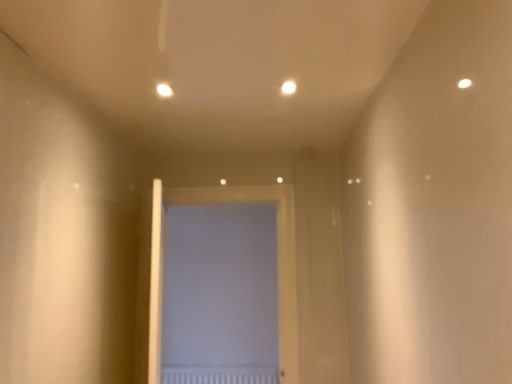
Question: Does white matte door at center turn towards white textured radiator at center?

Choices:
 (A) yes
 (B) no

Answer: (B)

Question: From a real-world perspective, is white matte door at center below white textured radiator at center?

Choices:
 (A) no
 (B) yes

Answer: (A)

Question: Would you say white matte door at center contains white textured radiator at center?

Choices:
 (A) yes
 (B) no

Answer: (B)

Question: Is white matte door at center turned away from white textured radiator at center?

Choices:
 (A) no
 (B) yes

Answer: (B)

Question: Is white matte door at center next to white textured radiator at center?

Choices:
 (A) yes
 (B) no

Answer: (B)

Question: Is matte white light at upper center, the second light viewed from the right, to the left or to the right of white matte door at center in the image?

Choices:
 (A) right
 (B) left

Answer: (B)

Question: Based on their sizes in the image, would you say matte white light at upper center, the second light viewed from the right, is bigger or smaller than white matte door at center?

Choices:
 (A) big
 (B) small

Answer: (B)

Question: Is matte white light at upper center, the second light viewed from the right, spatially inside white matte door at center, or outside of it?

Choices:
 (A) inside
 (B) outside

Answer: (B)

Question: From a real-world perspective, is matte white light at upper center, acting as the first light starting from the left, positioned above or below white matte door at center?

Choices:
 (A) below
 (B) above

Answer: (B)

Question: Is point (160, 89) closer or farther from the camera than point (285, 92)?

Choices:
 (A) closer
 (B) farther

Answer: (A)

Question: Considering the positions of matte white light at upper center, the second light viewed from the right, and white glossy light at upper center, the 1th light when ordered from right to left, in the image, is matte white light at upper center, the second light viewed from the right, taller or shorter than white glossy light at upper center, the 1th light when ordered from right to left,?

Choices:
 (A) tall
 (B) short

Answer: (B)

Question: From a real-world perspective, is matte white light at upper center, the second light viewed from the right, positioned above or below white glossy light at upper center, the 1th light when ordered from right to left?

Choices:
 (A) below
 (B) above

Answer: (A)

Question: Is matte white light at upper center, the second light viewed from the right, in front of or behind white glossy light at upper center, the 1th light when ordered from right to left, in the image?

Choices:
 (A) front
 (B) behind

Answer: (B)

Question: From a real-world perspective, is white matte door at center above or below white textured radiator at center?

Choices:
 (A) below
 (B) above

Answer: (B)

Question: Is point (154, 365) closer or farther from the camera than point (212, 372)?

Choices:
 (A) closer
 (B) farther

Answer: (A)